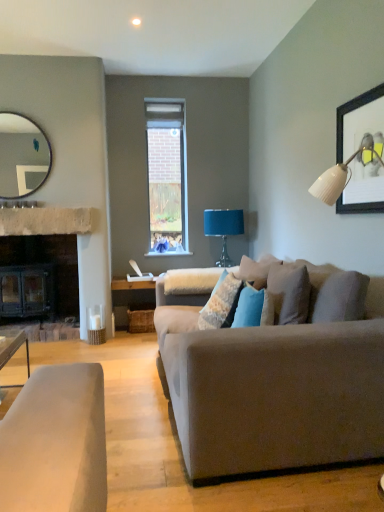
Question: Considering their positions, is matte silver mirror at upper left located in front of or behind wooden framed artwork at upper right?

Choices:
 (A) behind
 (B) front

Answer: (A)

Question: In terms of width, does matte silver mirror at upper left look wider or thinner when compared to wooden framed artwork at upper right?

Choices:
 (A) wide
 (B) thin

Answer: (A)

Question: Which object is the closest to the textured blue pillow at center?

Choices:
 (A) suede couch at center
 (B) matte silver mirror at upper left
 (C) wooden framed artwork at upper right
 (D) natural stone mantle at left
 (E) teal fabric lampshade at upper right

Answer: (A)

Question: Which object is positioned farthest from the teal fabric lampshade at upper right?

Choices:
 (A) wooden framed artwork at upper right
 (B) textured blue pillow at center
 (C) natural stone mantle at left
 (D) suede couch at center
 (E) matte silver mirror at upper left

Answer: (D)